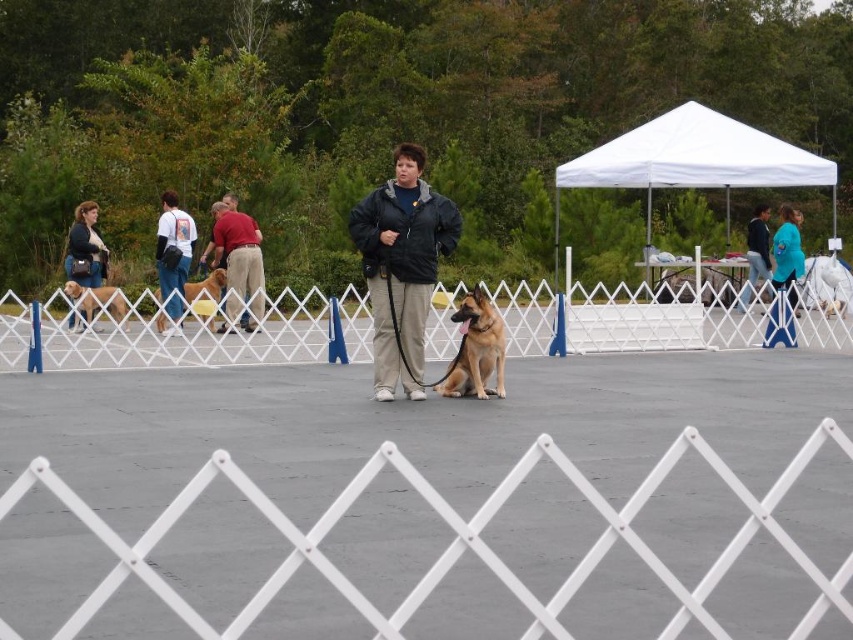
How distant is red shirt at center from golden brown fur at left?

red shirt at center is 5.86 feet away from golden brown fur at left.

Image resolution: width=853 pixels, height=640 pixels. Describe the element at coordinates (239, 264) in the screenshot. I see `red shirt at center` at that location.

Is point (234, 212) farther from camera compared to point (74, 298)?

Yes.

The width and height of the screenshot is (853, 640). Identify the location of red shirt at center. point(239,264).

Consider the image. Who is shorter, blue fabric jacket at upper right or golden brown fur at left?

golden brown fur at left

Does blue fabric jacket at upper right have a lesser height compared to golden brown fur at left?

In fact, blue fabric jacket at upper right may be taller than golden brown fur at left.

Who is more distant from viewer, (751, 236) or (73, 282)?

Positioned behind is point (751, 236).

Locate an element on the screen. The image size is (853, 640). blue fabric jacket at upper right is located at coordinates (756, 253).

Is white plastic fence at center wider than matte black jacket at upper left?

Yes.

Is point (584, 346) less distant than point (94, 212)?

Yes, it is in front of point (94, 212).

From the picture: Measure the distance between point (x=122, y=355) and camera.

Point (x=122, y=355) and camera are 16.45 meters apart from each other.

Where is `white plastic fence at center`? Image resolution: width=853 pixels, height=640 pixels. white plastic fence at center is located at coordinates (212, 333).